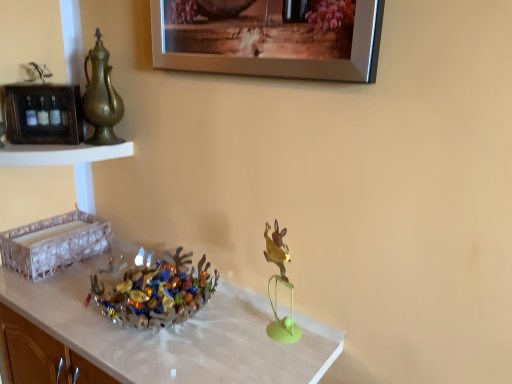
The width and height of the screenshot is (512, 384). Identify the location of vacant area on top of translucent glass tray at left, which is the 2th shelf from top to bottom (from a real-world perspective). (50, 229).